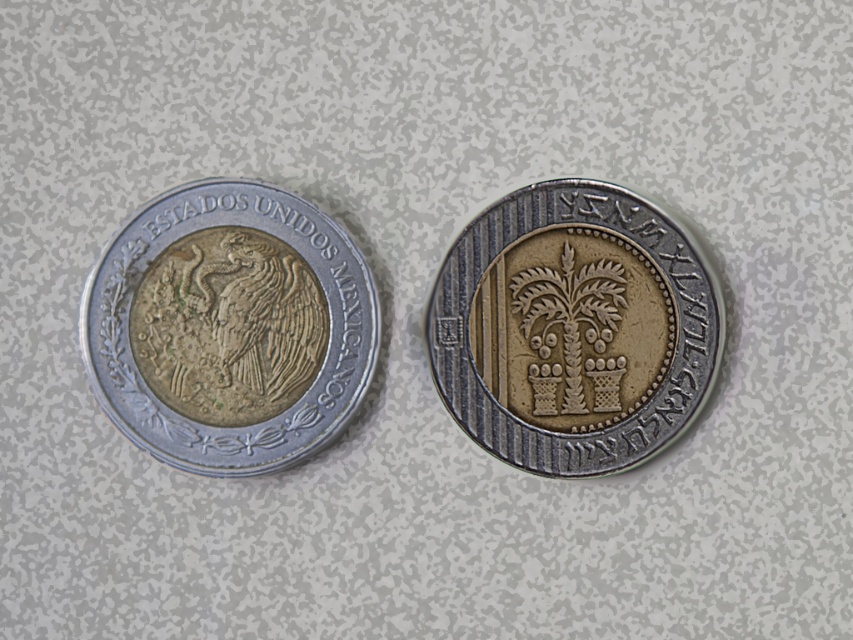
Question: Is silver metallic coin at left to the left of gold-plated palm tree at center from the viewer's perspective?

Choices:
 (A) no
 (B) yes

Answer: (B)

Question: Which point appears closest to the camera in this image?

Choices:
 (A) (450, 362)
 (B) (218, 200)

Answer: (B)

Question: Among these objects, which one is nearest to the camera?

Choices:
 (A) silver metallic coin at left
 (B) gold-plated palm tree at center

Answer: (A)

Question: Is silver metallic coin at left below gold-plated palm tree at center?

Choices:
 (A) yes
 (B) no

Answer: (B)

Question: Among these objects, which one is farthest from the camera?

Choices:
 (A) gold-plated palm tree at center
 (B) silver metallic coin at left

Answer: (A)

Question: Can you confirm if silver metallic coin at left is wider than gold-plated palm tree at center?

Choices:
 (A) no
 (B) yes

Answer: (A)